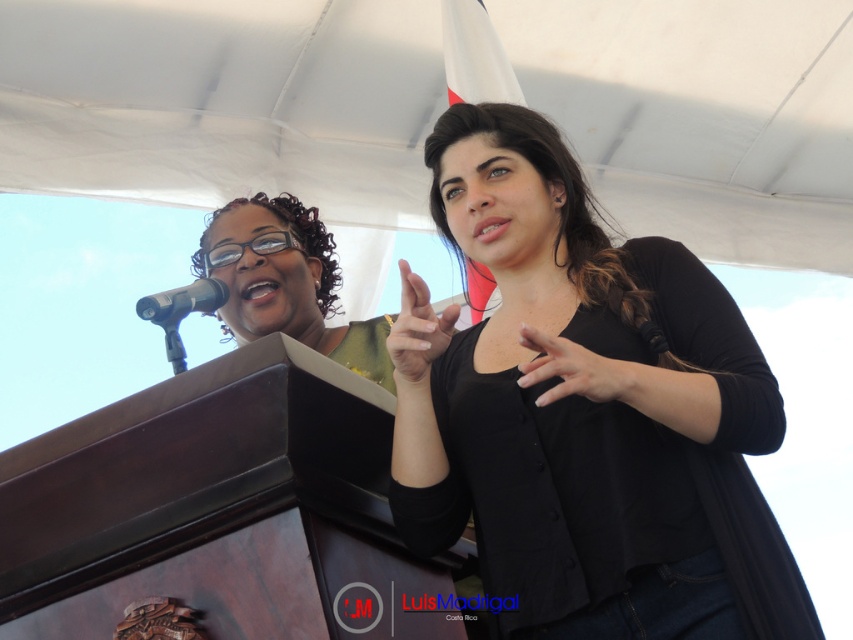
Question: Which object is farther from the camera taking this photo?

Choices:
 (A) matte black hand at center
 (B) black matte cardigan at center
 (C) matte black shirt at upper center

Answer: (C)

Question: Which object is closer to the camera taking this photo?

Choices:
 (A) black matte cardigan at center
 (B) matte black hand at center

Answer: (B)

Question: Does matte black hand at center appear on the left side of silver metallic microphone at left?

Choices:
 (A) yes
 (B) no

Answer: (B)

Question: Is matte black shirt at upper center to the left of silver metallic microphone at left from the viewer's perspective?

Choices:
 (A) no
 (B) yes

Answer: (A)

Question: Among these objects, which one is nearest to the camera?

Choices:
 (A) nail polish at center
 (B) matte black hand at center
 (C) silver metallic microphone at left
 (D) black matte cardigan at center

Answer: (B)

Question: Can you confirm if black matte cardigan at center is smaller than matte black hand at center?

Choices:
 (A) yes
 (B) no

Answer: (B)